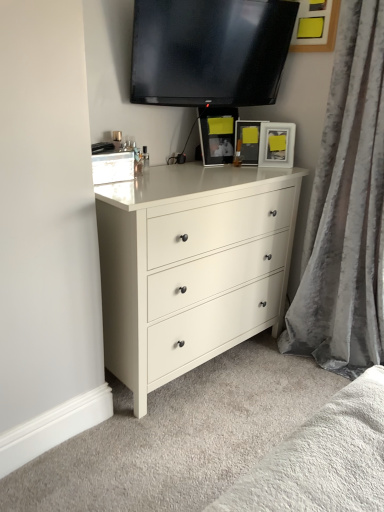
Find the location of a particular element. The image size is (384, 512). matte black picture frame at upper right, marked as the 3th picture frame in a left-to-right arrangement is located at coordinates (277, 145).

What do you see at coordinates (191, 266) in the screenshot?
I see `matte white dresser at center` at bounding box center [191, 266].

Locate an element on the screen. This screenshot has height=512, width=384. matte black picture frame at upper right, the 1th picture frame viewed from the right is located at coordinates (277, 145).

Considering the sizes of objects velvet gray curtain at right and matte black picture frame at center, which is the second picture frame from left to right, in the image provided, who is shorter, velvet gray curtain at right or matte black picture frame at center, which is the second picture frame from left to right,?

matte black picture frame at center, which is the second picture frame from left to right, is shorter.

From a real-world perspective, is velvet gray curtain at right physically located above or below matte black picture frame at center, which is the second picture frame from left to right?

From a real-world perspective, velvet gray curtain at right is physically below matte black picture frame at center, which is the second picture frame from left to right.

Is velvet gray curtain at right to the right of matte black picture frame at center, the second picture frame in the right-to-left sequence, from the viewer's perspective?

Correct, you'll find velvet gray curtain at right to the right of matte black picture frame at center, the second picture frame in the right-to-left sequence.

From the image's perspective, count 2nd picture frames upward from the velvet gray curtain at right and point to it. Please provide its 2D coordinates.

[(248, 141)]

Does point (309, 281) come behind point (210, 295)?

Yes, point (309, 281) is behind point (210, 295).

Is velvet gray curtain at right thinner than matte white dresser at center?

Yes, velvet gray curtain at right is thinner than matte white dresser at center.

From the picture: Is velvet gray curtain at right spatially inside matte white dresser at center, or outside of it?

The correct answer is: outside.

Considering the sizes of objects matte white dresser at center and matte black picture frame at center, which is the second picture frame from left to right, in the image provided, who is shorter, matte white dresser at center or matte black picture frame at center, which is the second picture frame from left to right,?

matte black picture frame at center, which is the second picture frame from left to right, is shorter.

You are a GUI agent. You are given a task and a screenshot of the screen. Output one action in this format:
    pyautogui.click(x=<x>, y=<y>)
    Task: Click on the picture frame that is the 3rd one when counting backward from the matte white dresser at center
    The width and height of the screenshot is (384, 512).
    Given the screenshot: What is the action you would take?
    pyautogui.click(x=248, y=141)

From the picture: Is matte white dresser at center behind matte black picture frame at center, which is the second picture frame from left to right?

No, it is not.

Is matte white dresser at center facing away from matte black picture frame at center, which is the second picture frame from left to right?

No, matte white dresser at center's orientation is not away from matte black picture frame at center, which is the second picture frame from left to right.

Is matte black picture frame at center, which is the second picture frame from left to right, at the left side of matte black picture frame at upper right, marked as the 3th picture frame in a left-to-right arrangement?

Indeed, matte black picture frame at center, which is the second picture frame from left to right, is positioned on the left side of matte black picture frame at upper right, marked as the 3th picture frame in a left-to-right arrangement.

From a real-world perspective, does matte black picture frame at center, the second picture frame in the right-to-left sequence, sit lower than matte black picture frame at upper right, marked as the 3th picture frame in a left-to-right arrangement?

No, from a real-world perspective, matte black picture frame at center, the second picture frame in the right-to-left sequence, is not below matte black picture frame at upper right, marked as the 3th picture frame in a left-to-right arrangement.

Where is `the 1st picture frame counting from the left side of the matte black picture frame at upper right, marked as the 3th picture frame in a left-to-right arrangement`? the 1st picture frame counting from the left side of the matte black picture frame at upper right, marked as the 3th picture frame in a left-to-right arrangement is located at coordinates (248, 141).

Based on their sizes in the image, would you say matte black picture frame at upper center, marked as the first picture frame in a left-to-right arrangement, is bigger or smaller than matte white dresser at center?

Clearly, matte black picture frame at upper center, marked as the first picture frame in a left-to-right arrangement, is smaller in size than matte white dresser at center.

What's the angular difference between matte black picture frame at upper center, which ranks as the 3th picture frame in right-to-left order, and matte white dresser at center's facing directions?

15.1 degrees separate the facing orientations of matte black picture frame at upper center, which ranks as the 3th picture frame in right-to-left order, and matte white dresser at center.

In order to click on the 1st picture frame behind the matte white dresser at center, counting from the anchor's position in this screenshot , I will do `click(217, 134)`.

Is matte black picture frame at upper center, marked as the first picture frame in a left-to-right arrangement, outside of matte white dresser at center?

Yes.

Considering the positions of objects matte black picture frame at upper right, marked as the 3th picture frame in a left-to-right arrangement, and matte black picture frame at center, the second picture frame in the right-to-left sequence, in the image provided, who is more to the left, matte black picture frame at upper right, marked as the 3th picture frame in a left-to-right arrangement, or matte black picture frame at center, the second picture frame in the right-to-left sequence,?

matte black picture frame at center, the second picture frame in the right-to-left sequence.

Would you say matte black picture frame at upper right, the 1th picture frame viewed from the right, is outside matte black picture frame at center, which is the second picture frame from left to right?

matte black picture frame at upper right, the 1th picture frame viewed from the right, is positioned outside matte black picture frame at center, which is the second picture frame from left to right.

Who is shorter, matte black picture frame at upper right, marked as the 3th picture frame in a left-to-right arrangement, or matte black picture frame at center, which is the second picture frame from left to right?

matte black picture frame at center, which is the second picture frame from left to right, is shorter.

Is matte black picture frame at upper right, the 1th picture frame viewed from the right, wider than matte black picture frame at center, the second picture frame in the right-to-left sequence?

Yes.

From a real-world perspective, is matte black picture frame at upper center, which ranks as the 3th picture frame in right-to-left order, physically above matte black picture frame at center, which is the second picture frame from left to right?

Yes, from a real-world perspective, matte black picture frame at upper center, which ranks as the 3th picture frame in right-to-left order, is over matte black picture frame at center, which is the second picture frame from left to right

Is matte black picture frame at upper center, which ranks as the 3th picture frame in right-to-left order, behind matte black picture frame at center, the second picture frame in the right-to-left sequence?

No.

Is matte black picture frame at upper center, marked as the first picture frame in a left-to-right arrangement, bigger than matte black picture frame at center, the second picture frame in the right-to-left sequence?

Yes, matte black picture frame at upper center, marked as the first picture frame in a left-to-right arrangement, is bigger than matte black picture frame at center, the second picture frame in the right-to-left sequence.

Does matte black picture frame at upper center, marked as the first picture frame in a left-to-right arrangement, have a greater height compared to matte black picture frame at center, the second picture frame in the right-to-left sequence?

Correct, matte black picture frame at upper center, marked as the first picture frame in a left-to-right arrangement, is much taller as matte black picture frame at center, the second picture frame in the right-to-left sequence.

Where is `the 2nd picture frame to the left of the velvet gray curtain at right, counting from the anchor's position`? the 2nd picture frame to the left of the velvet gray curtain at right, counting from the anchor's position is located at coordinates (248, 141).

This screenshot has height=512, width=384. In order to click on curtain in front of the matte white dresser at center in this screenshot , I will do `click(346, 209)`.

When comparing their distances from matte black picture frame at upper right, marked as the 3th picture frame in a left-to-right arrangement, does matte white dresser at center or velvet gray curtain at right seem closer?

velvet gray curtain at right is closer to matte black picture frame at upper right, marked as the 3th picture frame in a left-to-right arrangement.

Looking at the image, which one is located closer to black glossy tv at upper center, matte black picture frame at upper center, which ranks as the 3th picture frame in right-to-left order, or matte black picture frame at center, the second picture frame in the right-to-left sequence?

Based on the image, matte black picture frame at upper center, which ranks as the 3th picture frame in right-to-left order, appears to be nearer to black glossy tv at upper center.

Considering their positions, is matte black picture frame at upper right, the 1th picture frame viewed from the right, positioned further to matte black picture frame at center, the second picture frame in the right-to-left sequence, than matte white dresser at center?

matte white dresser at center.

Based on their spatial positions, is black glossy tv at upper center or matte black picture frame at upper center, marked as the first picture frame in a left-to-right arrangement, closer to matte black picture frame at upper right, the 1th picture frame viewed from the right?

matte black picture frame at upper center, marked as the first picture frame in a left-to-right arrangement.

Based on the photo, considering their positions, is velvet gray curtain at right positioned further to matte black picture frame at upper center, which ranks as the 3th picture frame in right-to-left order, than matte black picture frame at center, which is the second picture frame from left to right?

velvet gray curtain at right.

Considering their positions, is velvet gray curtain at right positioned further to black glossy tv at upper center than matte black picture frame at upper center, which ranks as the 3th picture frame in right-to-left order?

Among the two, velvet gray curtain at right is located further to black glossy tv at upper center.

Looking at the image, which one is located closer to matte white dresser at center, matte black picture frame at center, which is the second picture frame from left to right, or black glossy tv at upper center?

matte black picture frame at center, which is the second picture frame from left to right, lies closer to matte white dresser at center than the other object.

From the image, which object appears to be nearer to black glossy tv at upper center, matte black picture frame at upper center, which ranks as the 3th picture frame in right-to-left order, or matte white dresser at center?

matte black picture frame at upper center, which ranks as the 3th picture frame in right-to-left order, is closer to black glossy tv at upper center.

Identify the location of picture frame between black glossy tv at upper center and matte black picture frame at upper right, the 1th picture frame viewed from the right, in the front-back direction. (217, 134).

This screenshot has height=512, width=384. In order to click on curtain that lies between black glossy tv at upper center and matte white dresser at center from top to bottom in this screenshot , I will do `click(346, 209)`.

Find the location of a particular element. The image size is (384, 512). picture frame between matte black picture frame at upper center, marked as the first picture frame in a left-to-right arrangement, and matte black picture frame at upper right, marked as the 3th picture frame in a left-to-right arrangement is located at coordinates point(248,141).

Find the location of a particular element. the chest of drawers located between velvet gray curtain at right and matte black picture frame at upper right, marked as the 3th picture frame in a left-to-right arrangement, in the depth direction is located at coordinates (191, 266).